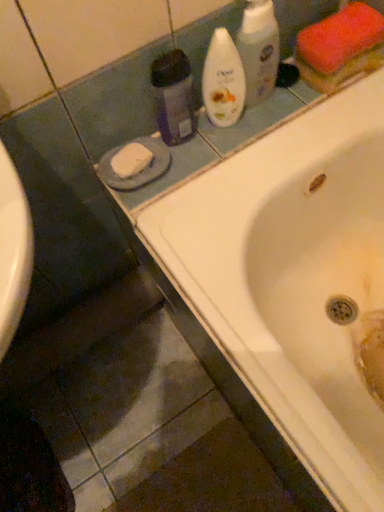
Question: Visually, is white glossy bathtub at upper center positioned to the left or to the right of white glossy bottle at upper center, marked as the 2th cleaning product in a right-to-left arrangement?

Choices:
 (A) left
 (B) right

Answer: (B)

Question: Relative to white glossy bottle at upper center, which is the 2th cleaning product in left-to-right order, is white glossy bathtub at upper center in front or behind?

Choices:
 (A) behind
 (B) front

Answer: (B)

Question: Considering the real-world distances, which object is farthest from the white glossy bathtub at upper center?

Choices:
 (A) white glossy bottle at upper center, marked as the 2th cleaning product in a right-to-left arrangement
 (B) translucent purple bottle at upper center, acting as the third cleaning product starting from the right
 (C) white glossy bottle at upper center, which ranks as the third cleaning product in left-to-right order

Answer: (C)

Question: Which object is positioned farthest from the translucent purple bottle at upper center, which is counted as the first cleaning product, starting from the left?

Choices:
 (A) white glossy bottle at upper center, which is the 2th cleaning product in left-to-right order
 (B) white glossy bathtub at upper center
 (C) white glossy bottle at upper center, which ranks as the third cleaning product in left-to-right order

Answer: (B)